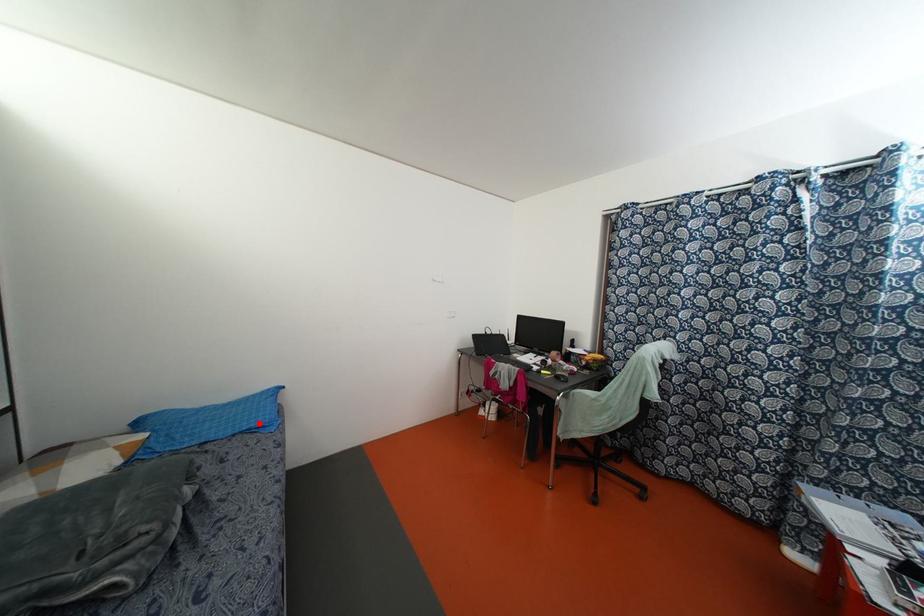
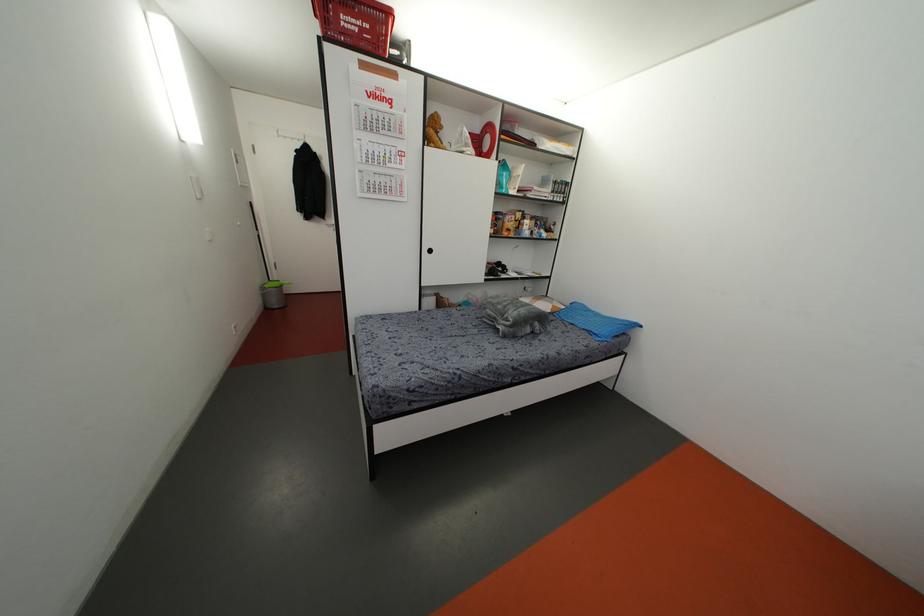
The point at the highlighted location is marked in the first image. Where is the corresponding point in the second image?

(596, 331)